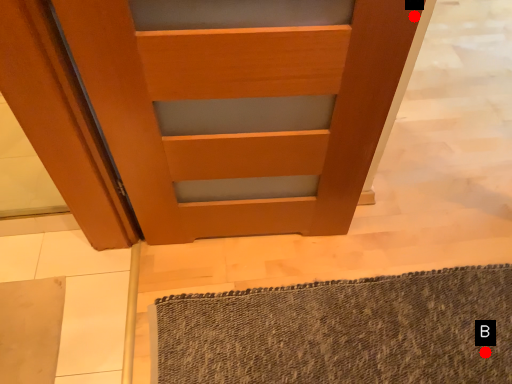
Question: Two points are circled on the image, labeled by A and B beside each circle. Which of the following is the farthest from the observer?

Choices:
 (A) A is further
 (B) B is further

Answer: (B)